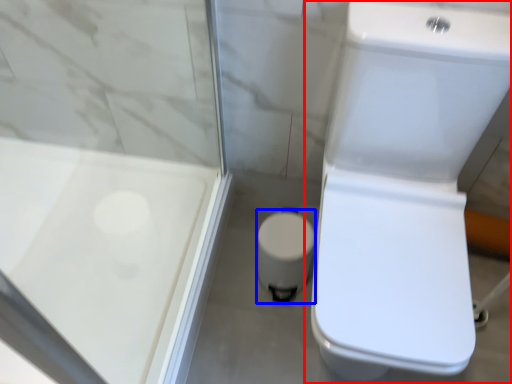
Question: Which object appears closest to the camera in this image, toilet (highlighted by a red box) or porcelain (highlighted by a blue box)?

Choices:
 (A) toilet
 (B) porcelain

Answer: (A)